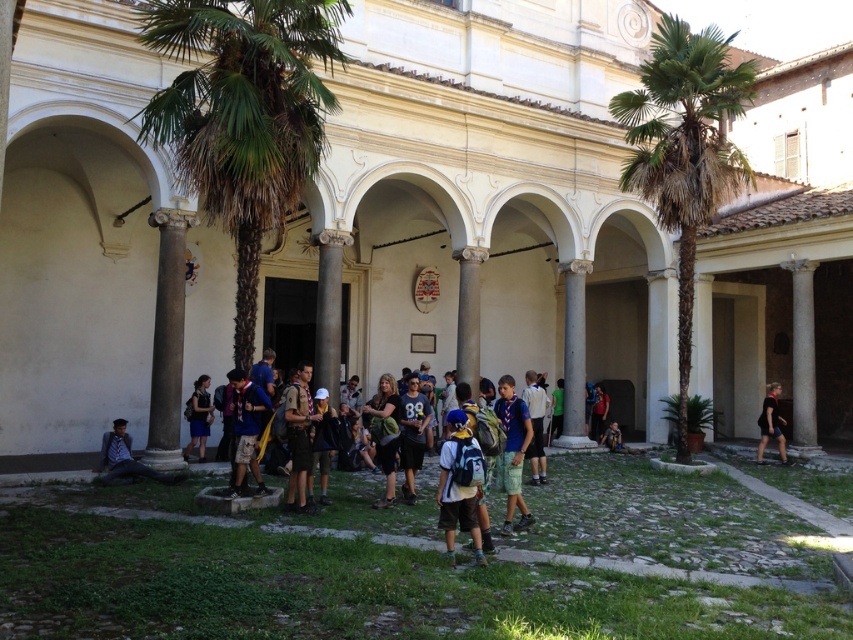
Between white marble column at center and dark blue uniform at center, which one is positioned higher?

white marble column at center

Based on the photo, who is more forward, (165, 429) or (299, 500)?

Positioned in front is point (299, 500).

Does point (149, 428) come behind point (302, 468)?

Yes, point (149, 428) is farther from viewer.

The height and width of the screenshot is (640, 853). I want to click on white marble column at center, so click(x=167, y=340).

Between point (393, 147) and point (289, 426), which one is positioned in front?

Point (289, 426) is in front.

Is white smooth building at center to the left of dark blue uniform at center from the viewer's perspective?

Incorrect, white smooth building at center is not on the left side of dark blue uniform at center.

Is point (485, 285) in front of point (305, 435)?

No, (485, 285) is further to viewer.

Locate an element on the screen. This screenshot has width=853, height=640. white smooth building at center is located at coordinates pos(479,202).

Does light blue denim shorts at center appear over white marble pillar at center?

Incorrect, light blue denim shorts at center is not positioned above white marble pillar at center.

Find the location of a particular element. This screenshot has height=640, width=853. light blue denim shorts at center is located at coordinates (459, 484).